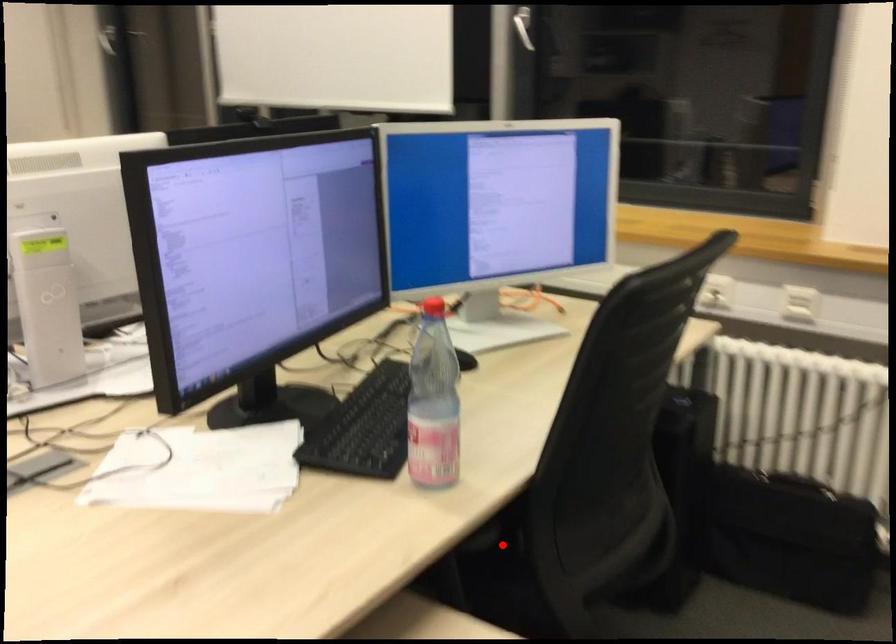
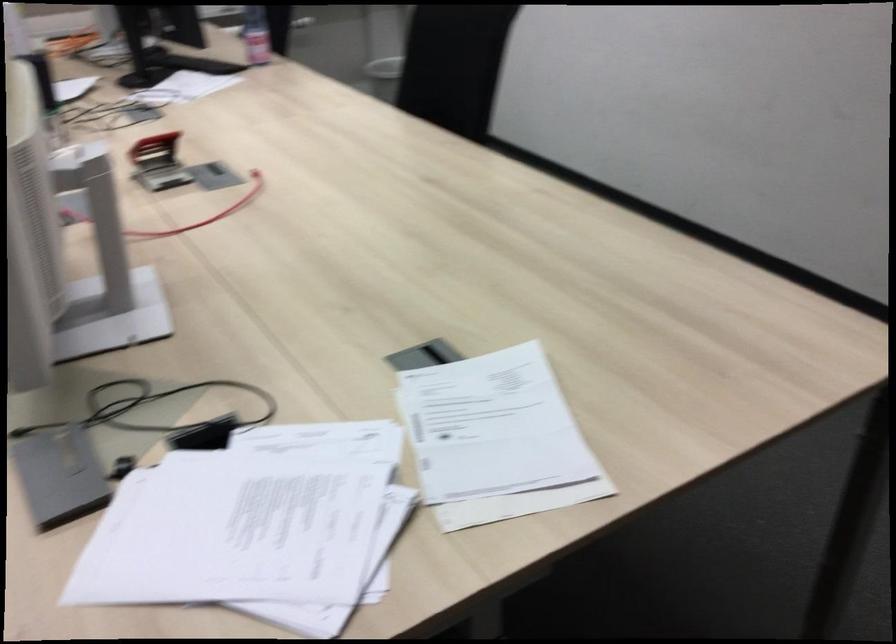
Question: I am providing you with two images of the same scene from different viewpoints. A red point is marked on the first image. Can you still see the location of the red point in image 2?

Choices:
 (A) Yes
 (B) No

Answer: (B)